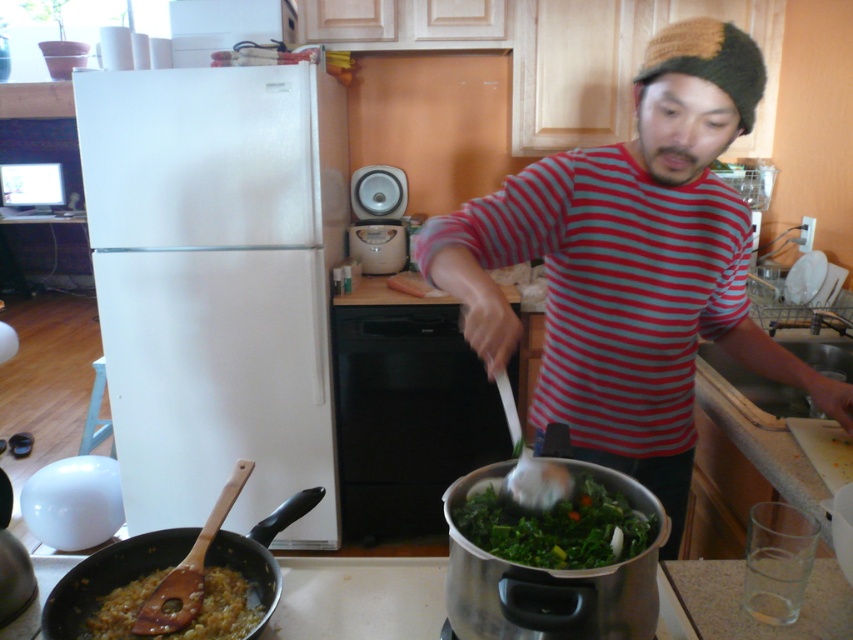
Question: Among these objects, which one is nearest to the camera?

Choices:
 (A) green leafy vegetables at center
 (B) woodenwoodenwok at lower left
 (C) striped cotton shirt at center
 (D) stainless steel wok at lower center

Answer: (D)

Question: Is green leafy vegetables at center thinner than woodenwoodenwok at lower left?

Choices:
 (A) yes
 (B) no

Answer: (A)

Question: Which point appears farthest from the camera in this image?

Choices:
 (A) (595, 465)
 (B) (292, 508)
 (C) (590, 500)
 (D) (108, 637)

Answer: (B)

Question: Can you confirm if stainless steel wok at lower center is wider than green leafy vegetables at center?

Choices:
 (A) no
 (B) yes

Answer: (B)

Question: Is green leafy vegetables at center to the left of woodenwoodenwok at lower left from the viewer's perspective?

Choices:
 (A) yes
 (B) no

Answer: (B)

Question: Which of the following is the farthest from the observer?

Choices:
 (A) (467, 292)
 (B) (195, 625)
 (C) (73, 584)

Answer: (C)